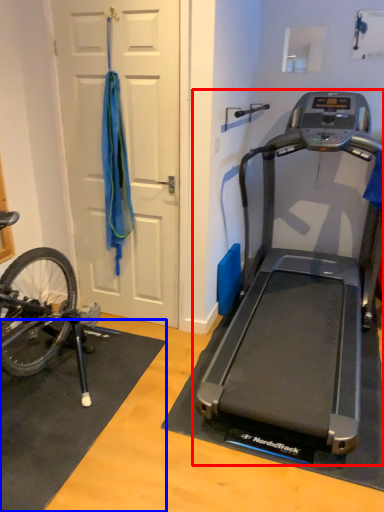
Question: Among these objects, which one is farthest to the camera, treadmill (highlighted by a red box) or doormat (highlighted by a blue box)?

Choices:
 (A) treadmill
 (B) doormat

Answer: (B)